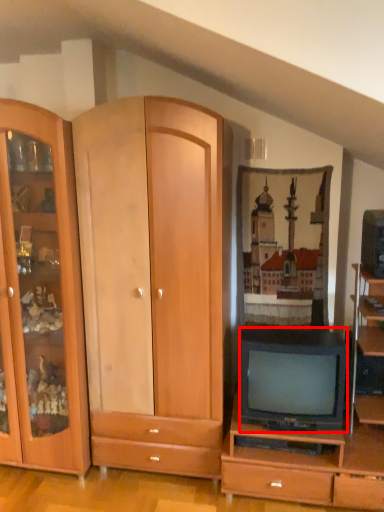
Question: From the image's perspective, where is television (annotated by the red box) located relative to television?

Choices:
 (A) above
 (B) below

Answer: (B)